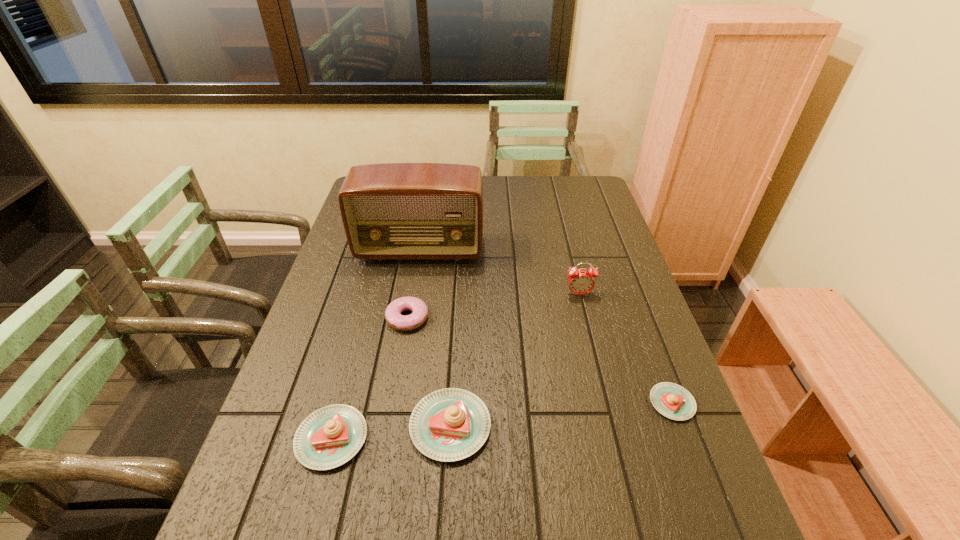
I want to click on the leftmost pastry, so click(329, 437).

Find the location of a particular element. Image resolution: width=960 pixels, height=540 pixels. the fourth tallest object is located at coordinates (329, 437).

Where is `the second pastry from right to left`? This screenshot has width=960, height=540. the second pastry from right to left is located at coordinates (451, 424).

Where is `the shortest object`? the shortest object is located at coordinates (673, 401).

The height and width of the screenshot is (540, 960). I want to click on the rightmost object, so click(x=673, y=401).

You are a GUI agent. You are given a task and a screenshot of the screen. Output one action in this format:
    pyautogui.click(x=<x>, y=<y>)
    Task: Click on the third farthest object
    Image resolution: width=960 pixels, height=540 pixels.
    Given the screenshot: What is the action you would take?
    pyautogui.click(x=393, y=316)

This screenshot has height=540, width=960. In order to click on doughnut in this screenshot , I will do `click(393, 316)`.

This screenshot has height=540, width=960. What are the coordinates of `the fifth shortest object` in the screenshot? It's located at (580, 282).

This screenshot has width=960, height=540. Find the location of `the second object from right to left`. the second object from right to left is located at coordinates (580, 282).

Identify the location of the tallest object. This screenshot has height=540, width=960. (391, 211).